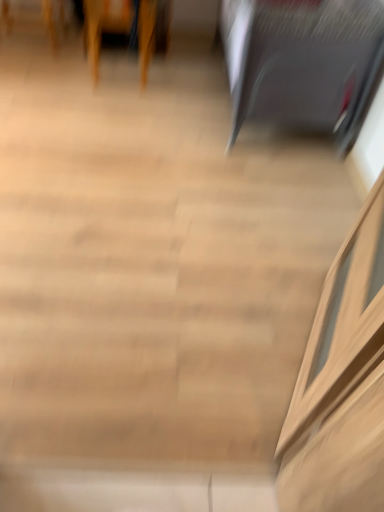
Question: From the image's perspective, is satin black laptop at upper right, the 2th furniture viewed from the left, located above or below wooden chair at upper left, the second furniture viewed from the right?

Choices:
 (A) below
 (B) above

Answer: (A)

Question: Looking at the image, does satin black laptop at upper right, the 2th furniture viewed from the left, seem bigger or smaller compared to wooden chair at upper left, which is counted as the first furniture, starting from the left?

Choices:
 (A) big
 (B) small

Answer: (A)

Question: Choose the correct answer: Is satin black laptop at upper right, the 2th furniture viewed from the left, inside wooden chair at upper left, which is counted as the first furniture, starting from the left, or outside it?

Choices:
 (A) outside
 (B) inside

Answer: (A)

Question: Does point (142, 28) appear closer or farther from the camera than point (316, 26)?

Choices:
 (A) farther
 (B) closer

Answer: (A)

Question: Considering the positions of wooden chair at upper left, the second furniture viewed from the right, and satin black laptop at upper right, the 2th furniture viewed from the left, in the image, is wooden chair at upper left, the second furniture viewed from the right, bigger or smaller than satin black laptop at upper right, the 2th furniture viewed from the left,?

Choices:
 (A) small
 (B) big

Answer: (A)

Question: Considering their positions, is wooden chair at upper left, which is counted as the first furniture, starting from the left, located in front of or behind satin black laptop at upper right, the 2th furniture viewed from the left?

Choices:
 (A) front
 (B) behind

Answer: (B)

Question: From a real-world perspective, is wooden chair at upper left, the second furniture viewed from the right, physically located above or below satin black laptop at upper right, the 2th furniture viewed from the left?

Choices:
 (A) above
 (B) below

Answer: (B)